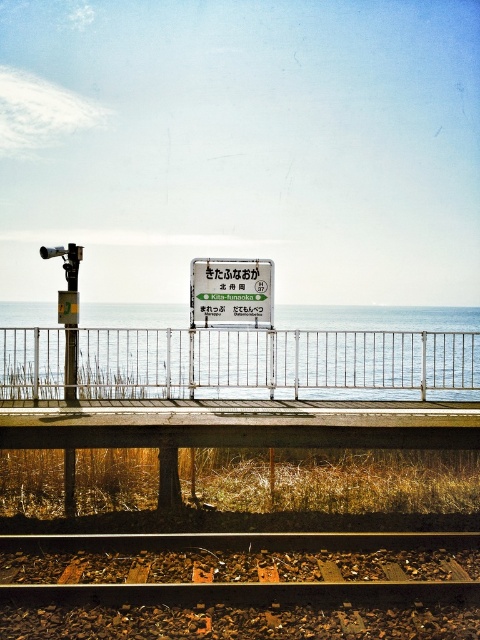
You are standing at the railway station platform in the image. There is a point marked at coordinates (345, 355). What does this point indicate?

The point at coordinates (345, 355) indicates the location of the blue water at center in the image.